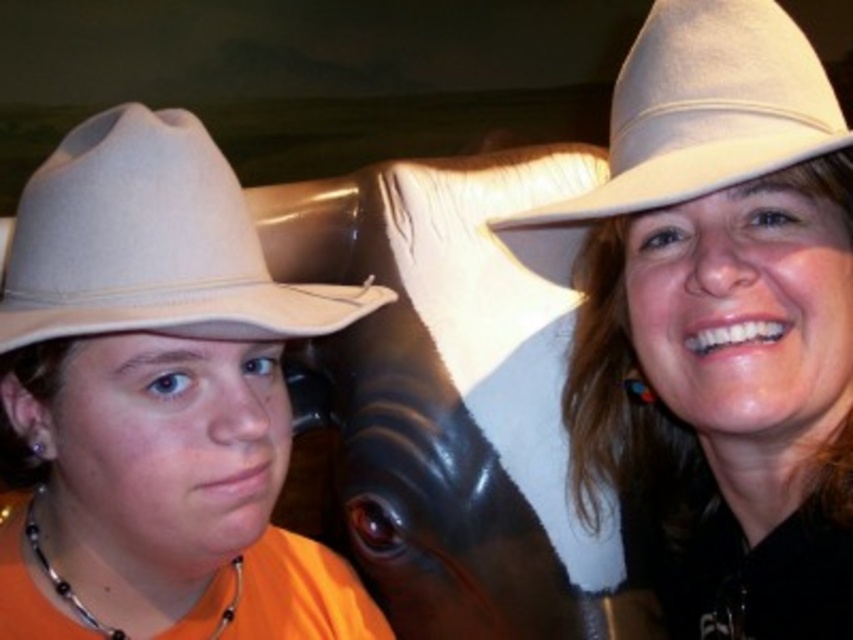
Which is below, white felt cowboy hat at upper center or beige felt cowboy hat at upper right?

white felt cowboy hat at upper center is lower down.

Between point (827, 173) and point (683, 83), which one is positioned behind?

The point (827, 173) is behind.

Find the location of `white felt cowboy hat at upper center`. white felt cowboy hat at upper center is located at coordinates (724, 316).

Is the position of felt cowboy hat at left less distant than that of beige felt cowboy hat at upper right?

Result: Yes, felt cowboy hat at left is closer to the viewer.

From the picture: Is felt cowboy hat at left taller than beige felt cowboy hat at upper right?

Incorrect, felt cowboy hat at left's height is not larger of beige felt cowboy hat at upper right's.

Describe the element at coordinates (151, 243) in the screenshot. This screenshot has width=853, height=640. I see `felt cowboy hat at left` at that location.

Where is `felt cowboy hat at left`? felt cowboy hat at left is located at coordinates (151, 243).

Which of these two, white felt cowboy hat at upper center or felt cowboy hat at left, stands taller?

Standing taller between the two is white felt cowboy hat at upper center.

Between point (849, 524) and point (198, 280), which one is positioned in front?

Point (198, 280)

The height and width of the screenshot is (640, 853). I want to click on white felt cowboy hat at upper center, so point(724,316).